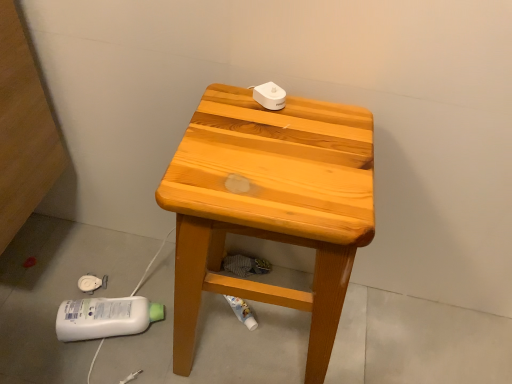
The width and height of the screenshot is (512, 384). In order to click on free space above light brown wooden stool at center (from a real-world perspective) in this screenshot , I will do `click(283, 152)`.